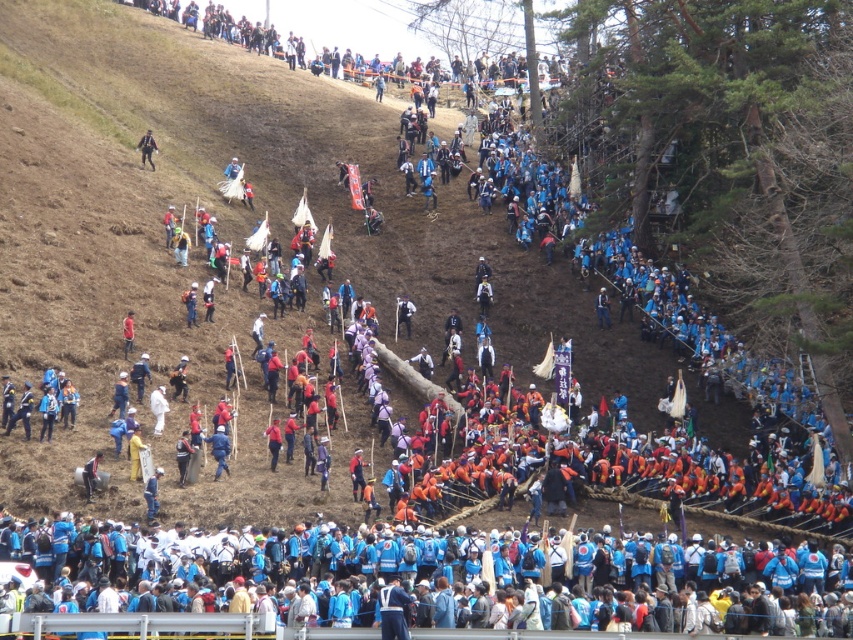
Question: Can you confirm if blue fabric backpack at lower center is thinner than matte black backpack at upper left?

Choices:
 (A) yes
 (B) no

Answer: (B)

Question: Among these objects, which one is farthest from the camera?

Choices:
 (A) blue fabric jacket at center
 (B) matte black backpack at upper left
 (C) red fabric flag at center

Answer: (B)

Question: Can you confirm if blue fabric backpack at lower center is wider than matte black backpack at upper left?

Choices:
 (A) no
 (B) yes

Answer: (B)

Question: Considering the relative positions of red fabric flag at center and matte black backpack at upper left in the image provided, where is red fabric flag at center located with respect to matte black backpack at upper left?

Choices:
 (A) left
 (B) right

Answer: (B)

Question: Among these points, which one is nearest to the camera?

Choices:
 (A) (738, 600)
 (B) (270, 433)
 (C) (143, 138)

Answer: (A)

Question: Which of these objects is positioned farthest from the blue fabric jacket at center?

Choices:
 (A) red fabric flag at center
 (B) matte black backpack at upper left

Answer: (B)